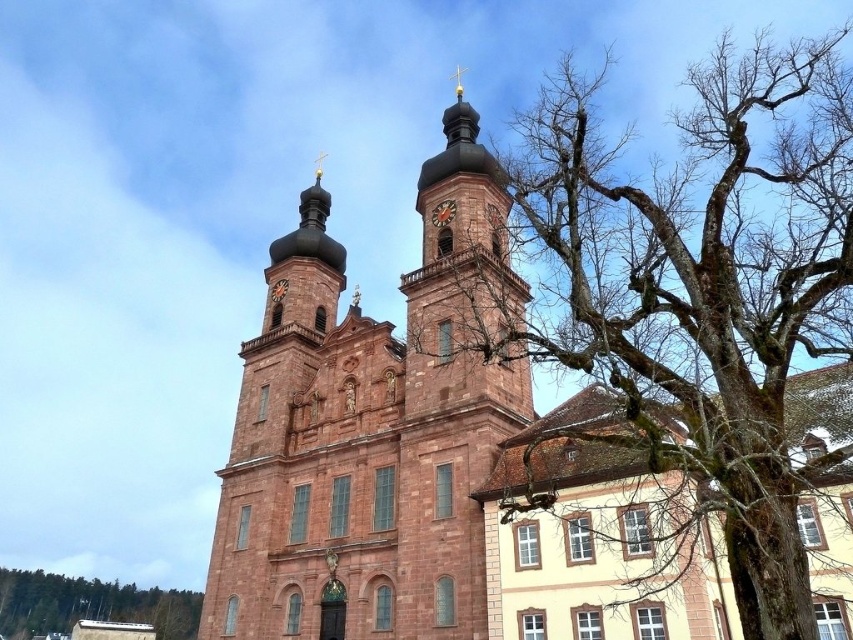
Is bare branches at upper right positioned at the back of bare wood tree at lower left?

No, bare branches at upper right is closer to the viewer.

Looking at this image, who is lower down, bare branches at upper right or bare wood tree at lower left?

Positioned lower is bare wood tree at lower left.

Is point (817, 253) farther from camera compared to point (134, 598)?

No, (817, 253) is closer to viewer.

Identify the location of bare branches at upper right. (682, 294).

Which is behind, point (267, 394) or point (437, 218)?

The point (267, 394) is more distant.

Describe the element at coordinates (369, 429) in the screenshot. I see `reddish-brown stone tower at center` at that location.

Between point (434, 432) and point (438, 209), which one is positioned behind?

The point (438, 209) is behind.

Identify the location of reddish-brown stone tower at center. Image resolution: width=853 pixels, height=640 pixels. (369, 429).

Which is more to the right, bare branches at upper right or gold metallic clock at upper center?

bare branches at upper right

Between point (825, 403) and point (433, 211), which one is positioned in front?

Point (825, 403) is more forward.

I want to click on bare branches at upper right, so click(682, 294).